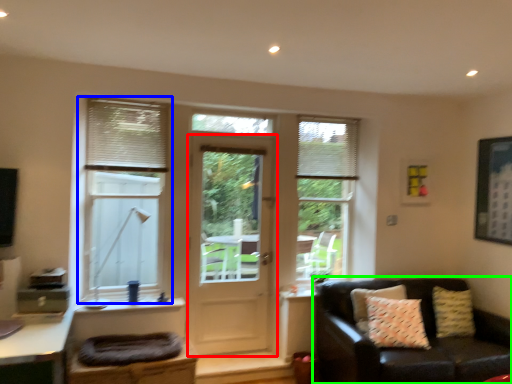
Question: Which object is positioned closest to door (highlighted by a red box)? Select from window (highlighted by a blue box) and studio couch (highlighted by a green box).

Choices:
 (A) window
 (B) studio couch

Answer: (A)